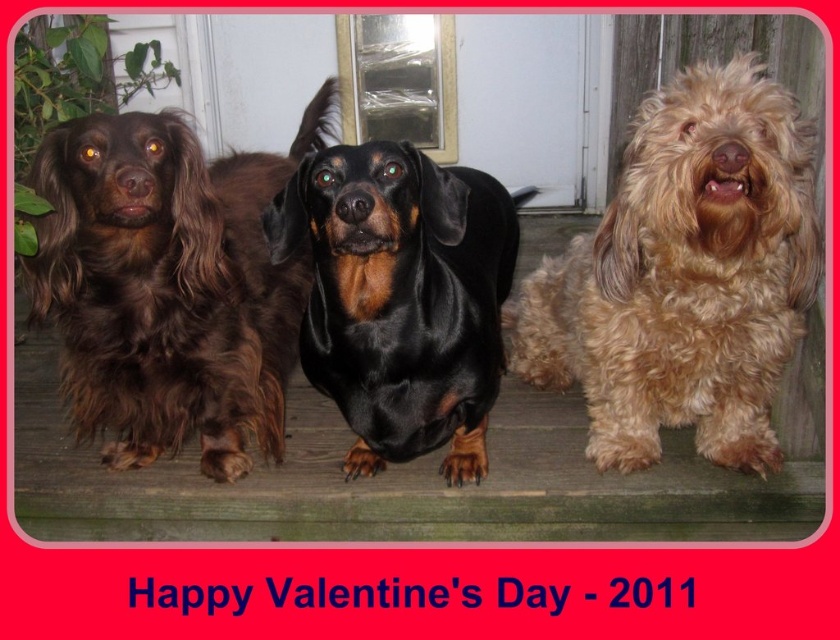
Question: Can you confirm if fuzzy golden dog at right is bigger than shiny brown fur at left?

Choices:
 (A) no
 (B) yes

Answer: (A)

Question: Can you confirm if fuzzy golden dog at right is smaller than black shiny coat at center?

Choices:
 (A) no
 (B) yes

Answer: (A)

Question: Considering the relative positions of fuzzy golden dog at right and black shiny coat at center in the image provided, where is fuzzy golden dog at right located with respect to black shiny coat at center?

Choices:
 (A) below
 (B) above

Answer: (A)

Question: Estimate the real-world distances between objects in this image. Which object is closer to the shiny brown fur at left?

Choices:
 (A) black shiny coat at center
 (B) fuzzy golden dog at right

Answer: (A)

Question: Which of these objects is positioned closest to the fuzzy golden dog at right?

Choices:
 (A) shiny brown fur at left
 (B) black shiny coat at center

Answer: (B)

Question: Which of the following is the farthest from the observer?

Choices:
 (A) black shiny coat at center
 (B) fuzzy golden dog at right

Answer: (B)